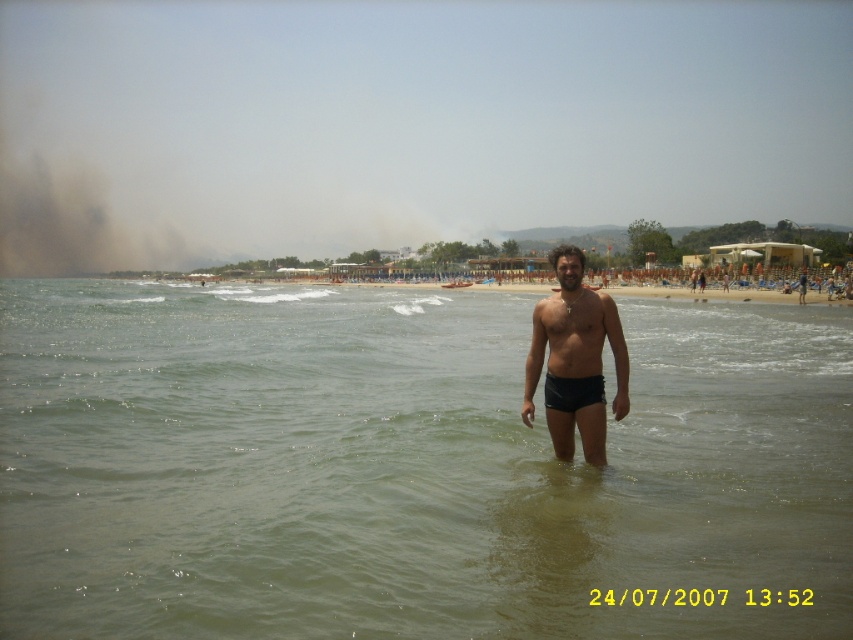
Does point (131, 582) lie in front of point (570, 376)?

Yes, point (131, 582) is closer to viewer.

Is greenish water at center wider than black matte shorts at center?

Correct, the width of greenish water at center exceeds that of black matte shorts at center.

You are a GUI agent. You are given a task and a screenshot of the screen. Output one action in this format:
    pyautogui.click(x=<x>, y=<y>)
    Task: Click on the greenish water at center
    The image size is (853, 640).
    Given the screenshot: What is the action you would take?
    pyautogui.click(x=410, y=468)

Locate an element on the screen. greenish water at center is located at coordinates (410, 468).